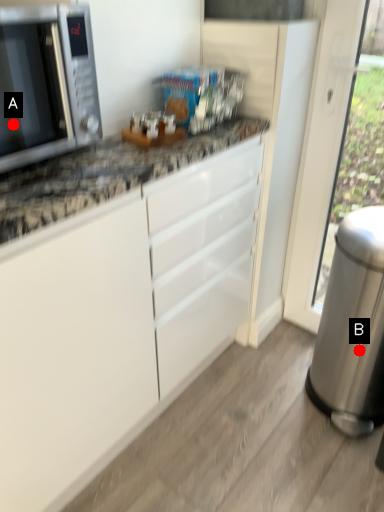
Question: Two points are circled on the image, labeled by A and B beside each circle. Which point is farther from the camera taking this photo?

Choices:
 (A) A is further
 (B) B is further

Answer: (B)